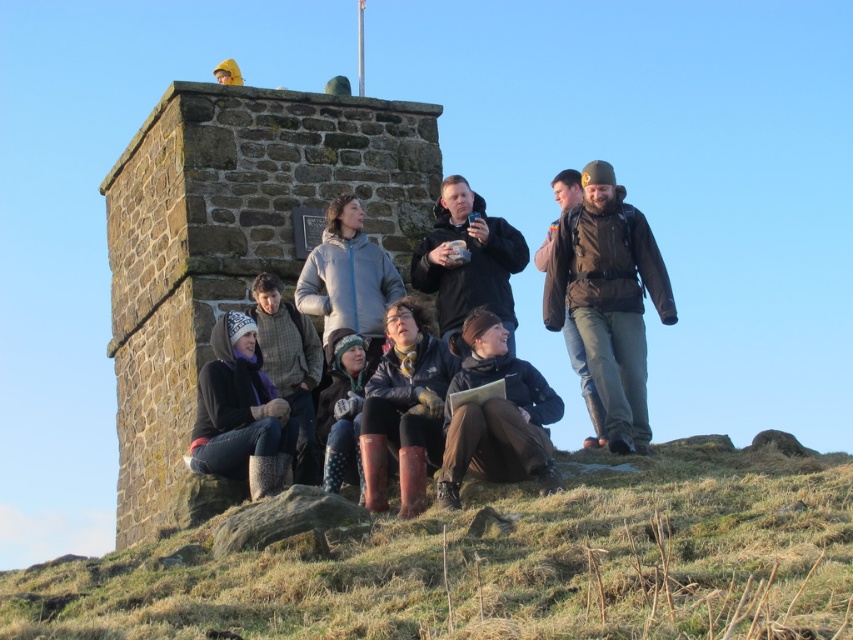
You are standing on the grassy hilltop near the stone structure and see the leather boots at center and the polka dot fabric pants at center. Which object is taller?

The leather boots at center is much taller as the polka dot fabric pants at center.

You are a photographer aiming to capture a closeup of the polka dot fabric pants at center without the leather boots at center blocking the view. Is this possible given their current positions?

The leather boots at center is positioned over polka dot fabric pants at center, so the boots are blocking the pants. To capture a clear view of the polka dot fabric pants at center, you would need to adjust the angle or position to avoid the obstruction caused by the leather boots at center.

You are standing at the stone structure and want to take a photo of both the point at coordinates (503,308) and the point at coordinates (389,300). Which point should you focus on first to ensure both are in focus?

You should focus on point (503,308) first because it is closer to the camera than point (389,300). This ensures the closer point is in focus, and the farther point will also be in focus due to the depth of field.